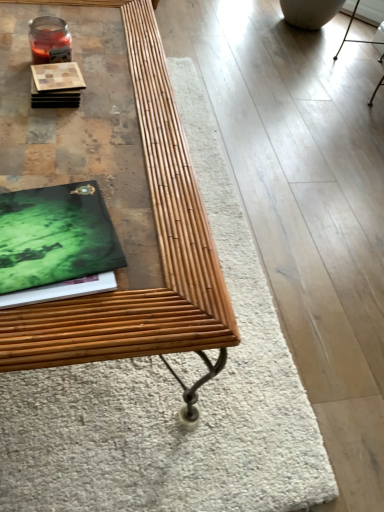
Image resolution: width=384 pixels, height=512 pixels. I want to click on vacant area that lies to the right of green matte book at left, so click(157, 271).